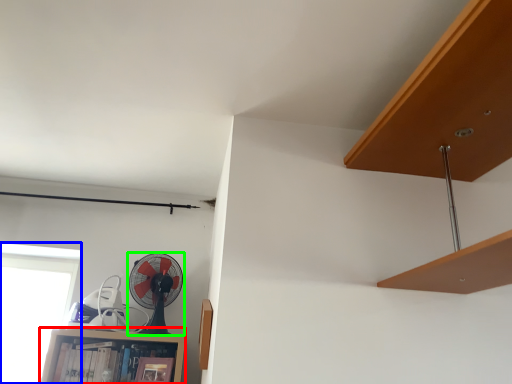
Question: Based on their relative distances, which object is nearer to cabinet (highlighted by a red box)? Choose from window (highlighted by a blue box) and mechanical fan (highlighted by a green box).

Choices:
 (A) window
 (B) mechanical fan

Answer: (B)